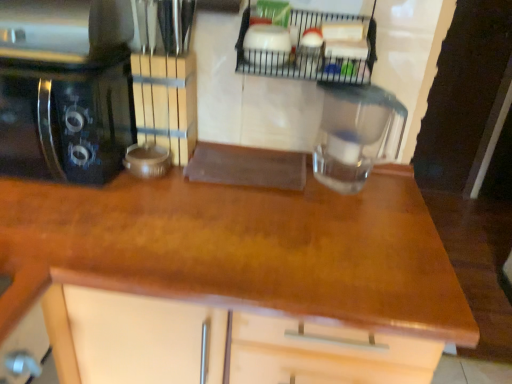
Identify the location of vacant space in front of transparent glass jar at center. Image resolution: width=512 pixels, height=384 pixels. (353, 225).